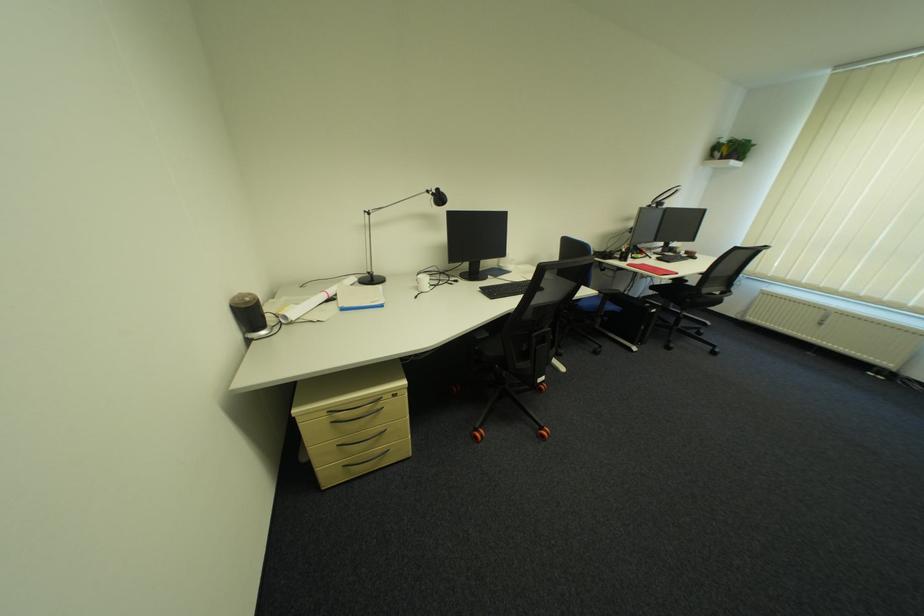
The height and width of the screenshot is (616, 924). I want to click on black computer mouse, so click(689, 254).